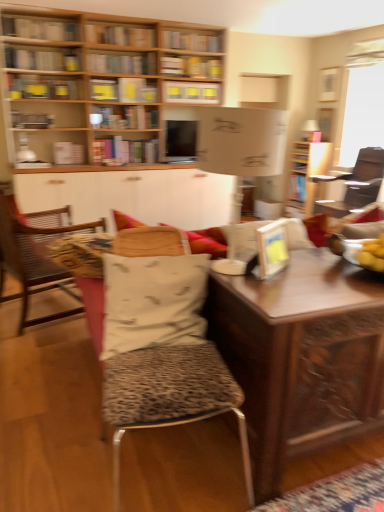
Question: Is point (51, 117) closer or farther from the camera than point (29, 231)?

Choices:
 (A) farther
 (B) closer

Answer: (A)

Question: Which is correct: metallic silver bookshelf at upper left, the eighth book viewed from the top, is inside leopard print cushion at left, or outside of it?

Choices:
 (A) outside
 (B) inside

Answer: (A)

Question: Considering the real-world distances, which object is farthest from the matte white book at upper center, the fifth book positioned from the top?

Choices:
 (A) hardcover book at upper center, placed as the 9th book when sorted from bottom to top
 (B) leopard print cushion at left
 (C) matte yellow book at upper left, the 4th book when ordered from top to bottom
 (D) hardcover book at upper left, which ranks as the first book in bottom-to-top order
 (E) yellow paper at upper center, the sixth book viewed from the top

Answer: (B)

Question: Estimate the real-world distances between objects in this image. Which object is closer to the hardcover book at upper center, the seventh book from the bottom?

Choices:
 (A) yellow paper at upper center, the sixth book viewed from the top
 (B) white fabric pillow at center
 (C) wooden bookshelf at upper center, marked as the 2th book in a top-to-bottom arrangement
 (D) matte yellow book at upper left, placed as the seventh book when sorted from top to bottom
 (E) leopard print fabric stool at center

Answer: (C)